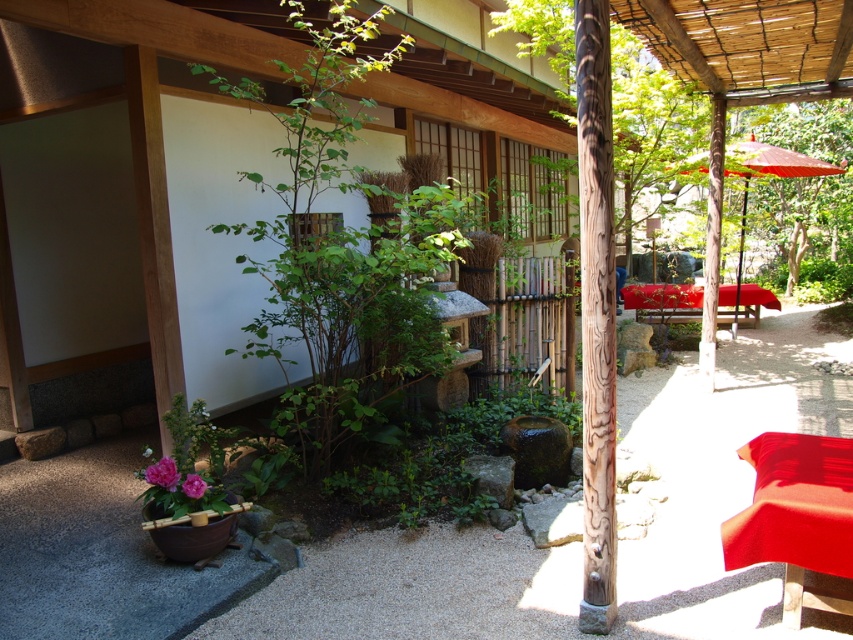
Is wooden pole at center thinner than green leafy tree at upper right?

Yes.

Is point (581, 38) less distant than point (834, 259)?

That is True.

Locate an element on the screen. The height and width of the screenshot is (640, 853). wooden pole at center is located at coordinates (596, 310).

Does point (583, 218) come behind point (824, 477)?

No, (583, 218) is in front of (824, 477).

Is point (579, 26) positioned in front of point (746, 560)?

Yes.

You are a GUI agent. You are given a task and a screenshot of the screen. Output one action in this format:
    pyautogui.click(x=<x>, y=<y>)
    Task: Click on the wooden pole at center
    
    Given the screenshot: What is the action you would take?
    pyautogui.click(x=596, y=310)

Between matte red cushion at center and red fabric umbrella at upper right, which one has less height?

With less height is matte red cushion at center.

Can you confirm if matte red cushion at center is smaller than red fabric umbrella at upper right?

Yes, matte red cushion at center is smaller than red fabric umbrella at upper right.

Does point (833, 465) lie in front of point (817, 163)?

Yes, point (833, 465) is in front of point (817, 163).

The image size is (853, 640). I want to click on matte red cushion at center, so click(796, 516).